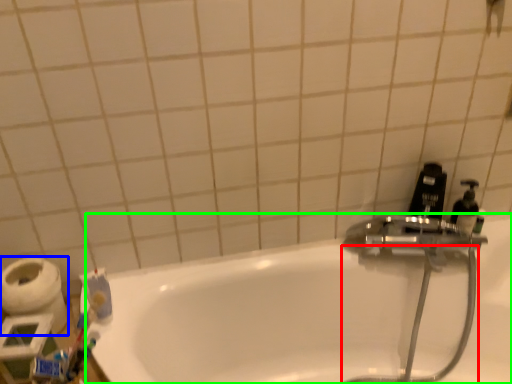
Question: Which object is the closest to the garden hose (highlighted by a red box)? Choose among these: toilet paper (highlighted by a blue box) or bathtub (highlighted by a green box).

Choices:
 (A) toilet paper
 (B) bathtub

Answer: (B)